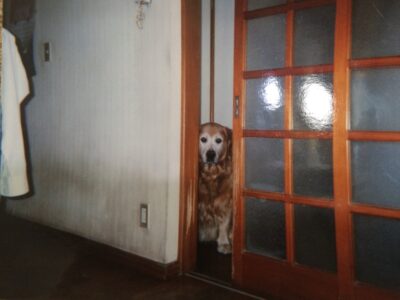
This screenshot has width=400, height=300. I want to click on floor, so click(x=113, y=281).